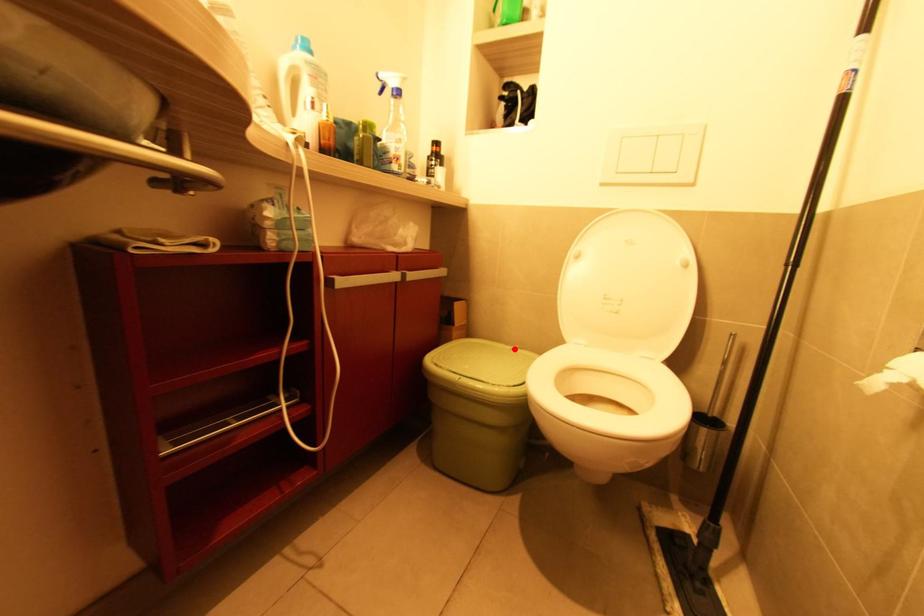
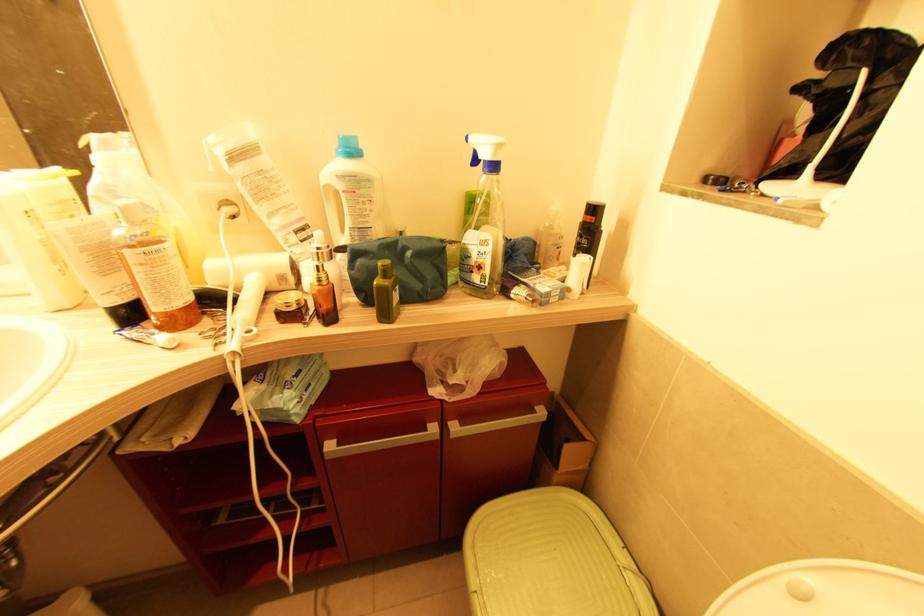
The point at the highlighted location is marked in the first image. Where is the corresponding point in the second image?

(626, 570)